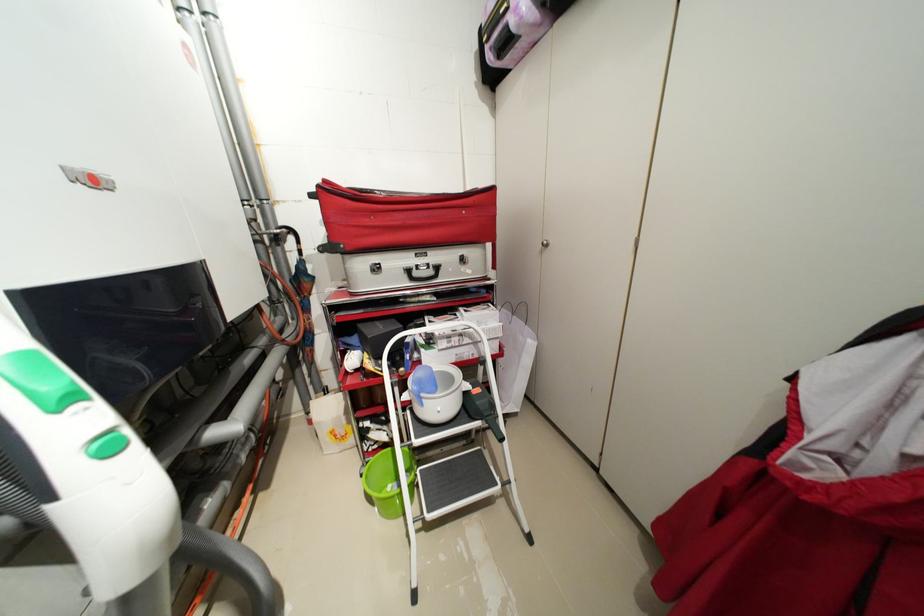
This screenshot has height=616, width=924. Identify the location of green bucket. (388, 482).